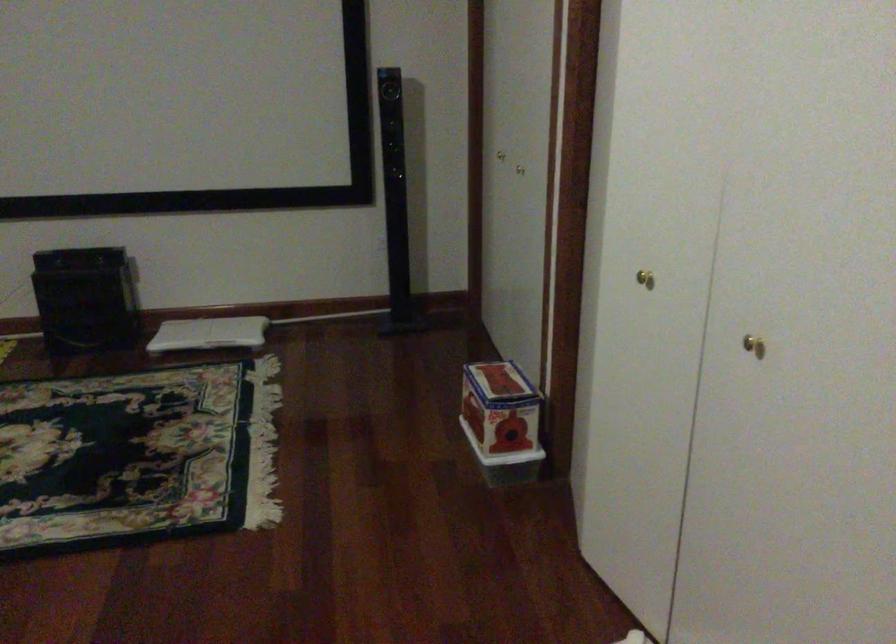
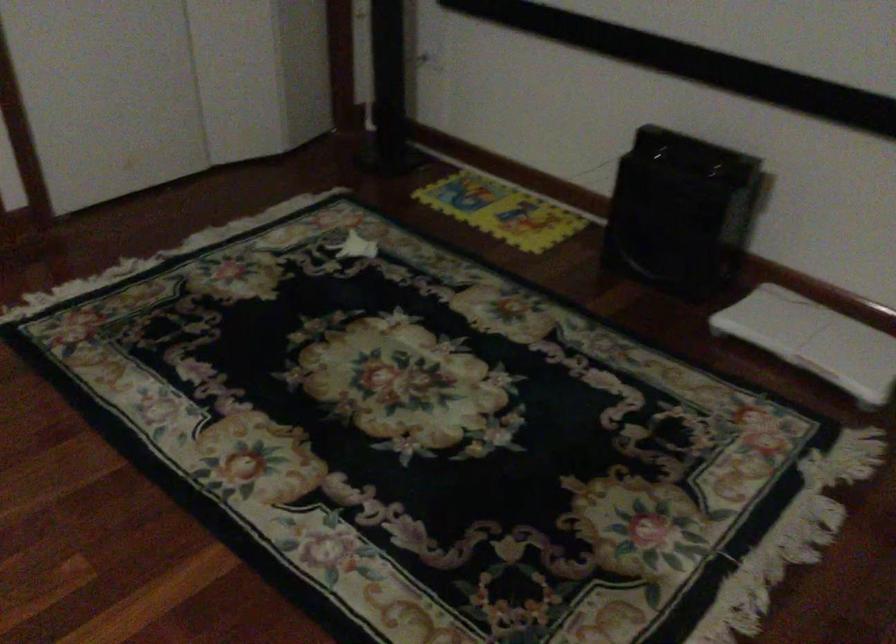
Where in the second image is the point corresponding to (204,328) from the first image?

(814, 339)